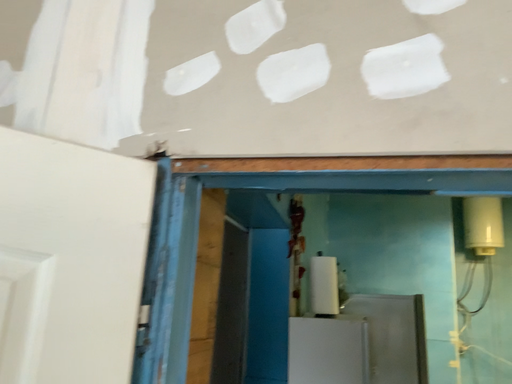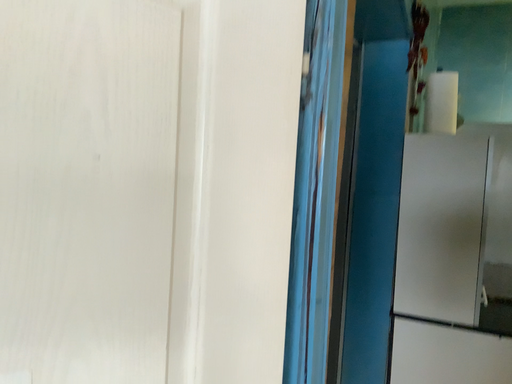
Question: How did the camera likely rotate when shooting the video?

Choices:
 (A) rotated left
 (B) rotated right

Answer: (A)